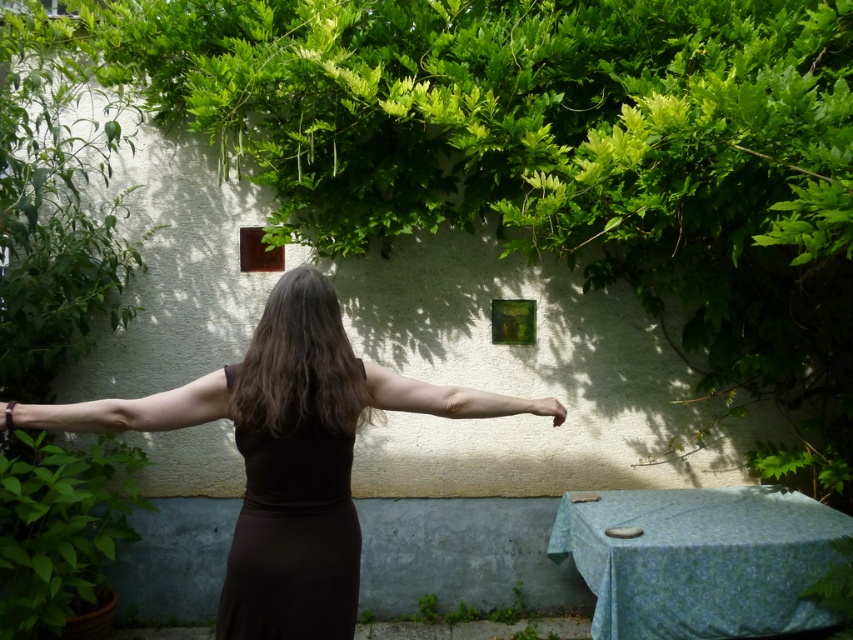
You are a photographer adjusting your camera to capture the scene. You notice the black matte dress at center and the matte black hand at center. Which object is located to the left of the other?

The black matte dress at center is positioned on the left side of matte black hand at center.